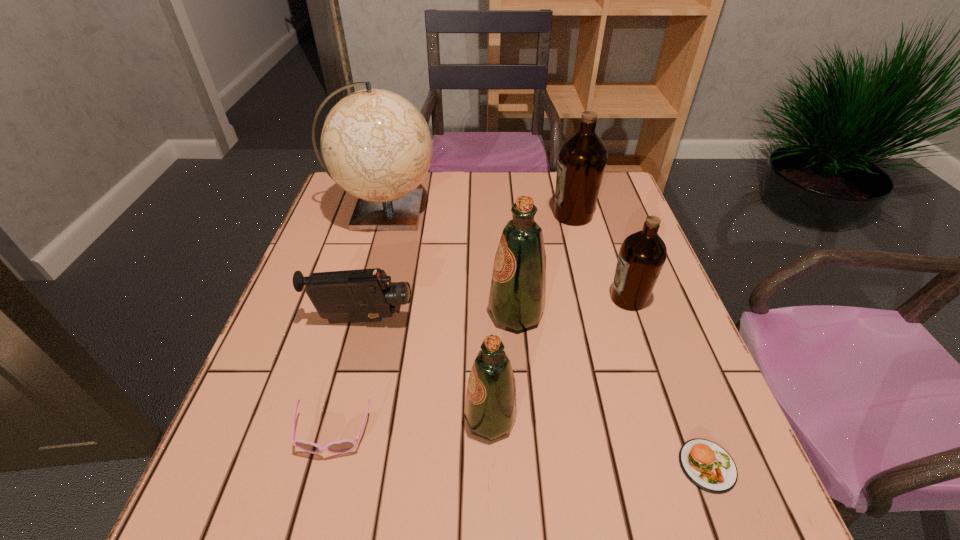
This screenshot has height=540, width=960. What are the coordinates of `free space located 0.090m on the front-facing side of the nearest olive oil` in the screenshot? It's located at (416, 420).

Find the location of a particular element. This screenshot has width=960, height=540. vacant space situated 0.200m on the front-facing side of the nearest olive oil is located at coordinates (355, 420).

You are a GUI agent. You are given a task and a screenshot of the screen. Output one action in this format:
    pyautogui.click(x=<x>, y=<y>)
    Task: Click on the vacant space located 0.330m on the front-facing side of the nearest olive oil
    The height and width of the screenshot is (540, 960).
    Given the screenshot: What is the action you would take?
    pyautogui.click(x=284, y=420)

Locate an element on the screen. vacant area situated 0.090m on the label of the nearer brown olive oil is located at coordinates (569, 298).

Where is `vacant space located on the label of the nearer brown olive oil`? The width and height of the screenshot is (960, 540). vacant space located on the label of the nearer brown olive oil is located at coordinates (458, 298).

This screenshot has height=540, width=960. In order to click on free spot located on the label of the nearer brown olive oil in this screenshot , I will do `click(514, 298)`.

This screenshot has height=540, width=960. Find the location of `free location located 0.070m on the front-facing side of the sixth tallest object`. free location located 0.070m on the front-facing side of the sixth tallest object is located at coordinates (445, 321).

Find the location of a particular element. This screenshot has height=540, width=960. vacant space located on the front-facing side of the pink sunglasses is located at coordinates (311, 523).

Locate an element on the screen. This screenshot has height=540, width=960. free space located on the back of the patty is located at coordinates (661, 345).

You are a GUI agent. You are given a task and a screenshot of the screen. Output one action in this format:
    pyautogui.click(x=<x>, y=<y>)
    Task: Click on the globe located in the far edge section of the desktop
    This screenshot has width=960, height=540.
    Given the screenshot: What is the action you would take?
    pyautogui.click(x=377, y=146)